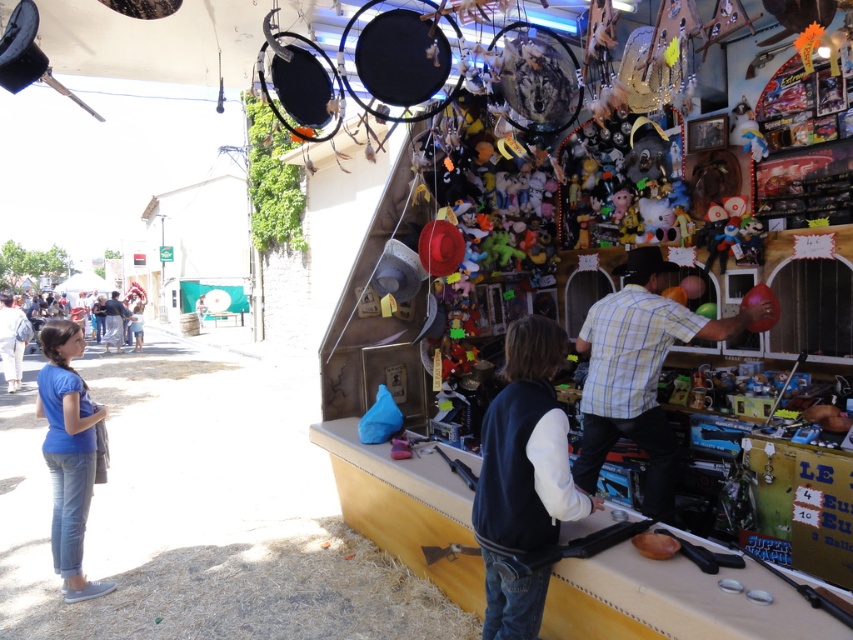
From the picture: You are at a fair and want to buy a shirt. You see a yellow plaid shirt at center and a blue cotton shirt at left. Which one is easier to reach without moving from your current spot?

The yellow plaid shirt at center is closer to the viewer, so it is easier to reach without moving from your current spot.

You are a photographer standing at the entrance of the fair. You notice a person wearing a yellow plaid shirt at center and light blue denim jeans at left. Which clothing item is closer to you?

The yellow plaid shirt at center is closer to you because it is in front of the light blue denim jeans at left.